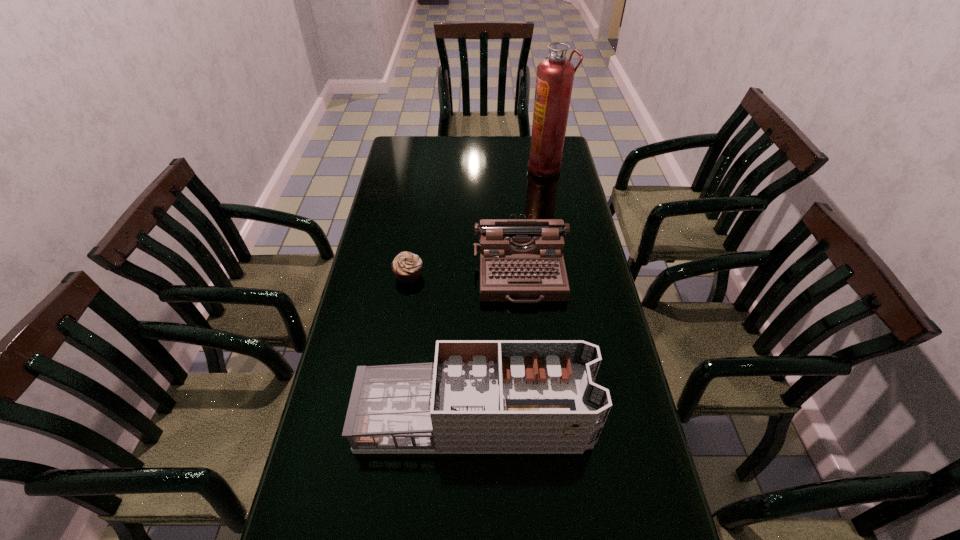
Where is `the farthest object`? The image size is (960, 540). the farthest object is located at coordinates (554, 81).

The width and height of the screenshot is (960, 540). I want to click on fire extinguisher, so click(x=554, y=81).

Locate an element on the screen. This screenshot has width=960, height=540. dollhouse is located at coordinates (479, 396).

Find the location of `the nearest object`. the nearest object is located at coordinates (479, 396).

Image resolution: width=960 pixels, height=540 pixels. In order to click on the second shortest object in this screenshot , I will do `click(521, 260)`.

This screenshot has height=540, width=960. I want to click on muffin, so click(x=407, y=266).

Image resolution: width=960 pixels, height=540 pixels. I want to click on free point located on the side of the fire extinguisher with the label, so click(509, 168).

Locate an element on the screen. The height and width of the screenshot is (540, 960). free space located on the side of the fire extinguisher with the label is located at coordinates (459, 168).

The height and width of the screenshot is (540, 960). Identify the location of free region located 0.230m on the side of the fire extinguisher with the label. (473, 168).

Where is `vacant space located on the keyboard of the third tallest object`? vacant space located on the keyboard of the third tallest object is located at coordinates (532, 395).